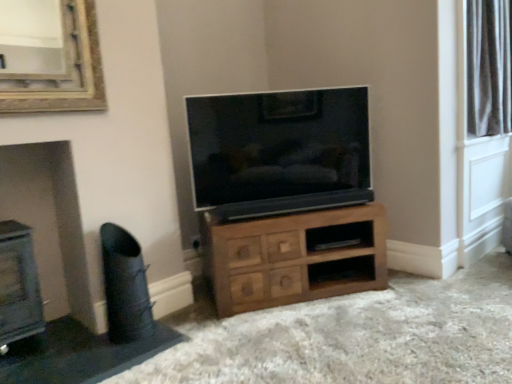
Identify the location of free space on the front side of black leather swivel chair at lower left. Image resolution: width=512 pixels, height=384 pixels. (112, 357).